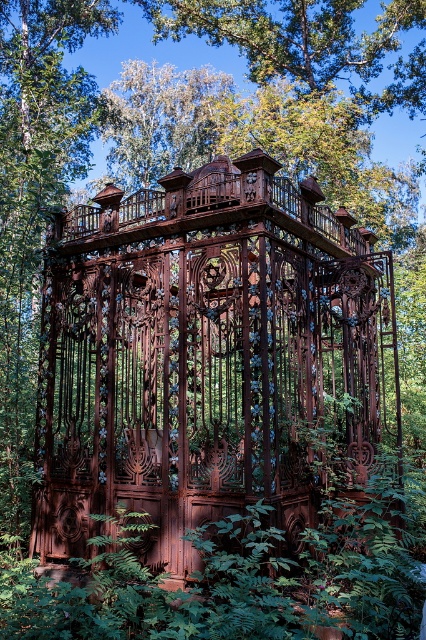
Question: Which point is closer to the camera taking this photo?

Choices:
 (A) (313, 540)
 (B) (138, 440)

Answer: (A)

Question: Is rusty metal gazebo at center positioned behind green leafy foliage at center?

Choices:
 (A) yes
 (B) no

Answer: (A)

Question: Does rusty metal gazebo at center have a greater width compared to green leafy foliage at center?

Choices:
 (A) yes
 (B) no

Answer: (A)

Question: From the image, what is the correct spatial relationship of rusty metal gazebo at center in relation to green leafy foliage at center?

Choices:
 (A) right
 (B) left

Answer: (A)